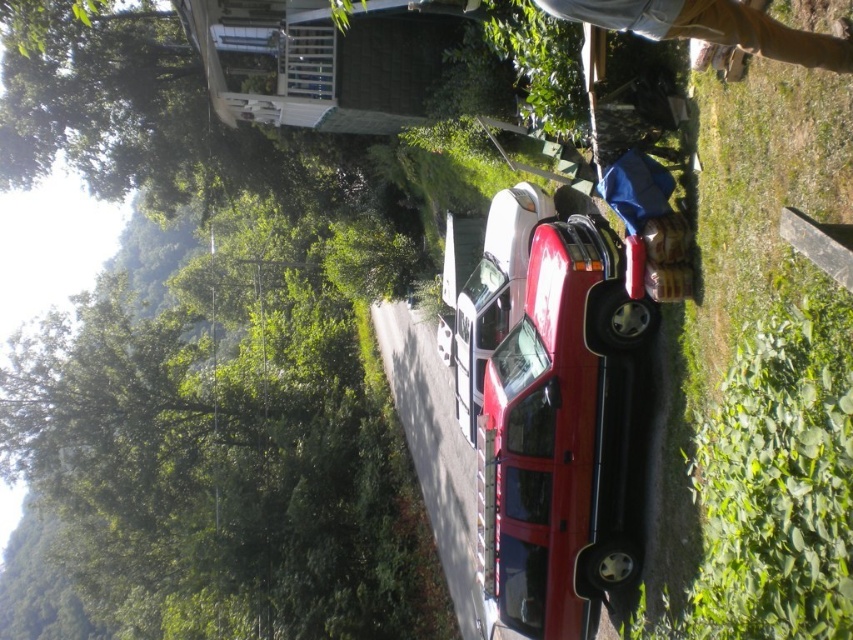
Is glossy red car at center smaller than tan denim pants at upper right?

Actually, glossy red car at center might be larger than tan denim pants at upper right.

Can you confirm if glossy red car at center is positioned to the right of tan denim pants at upper right?

Yes, glossy red car at center is to the right of tan denim pants at upper right.

At what (x,y) coordinates should I click in order to perform the action: click on glossy red car at center. Please return your answer as a coordinate pair (x, y). The height and width of the screenshot is (640, 853). Looking at the image, I should click on (566, 435).